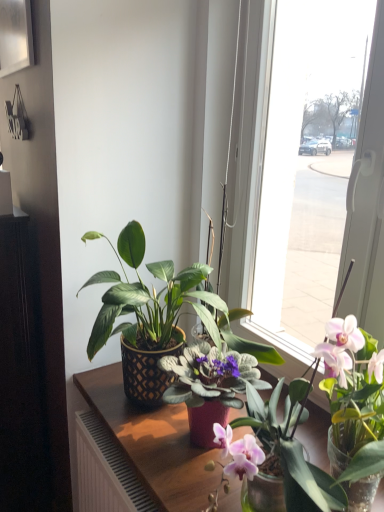
Question: Is wooden table at center taller or shorter than metallic silver picture frame at upper left?

Choices:
 (A) tall
 (B) short

Answer: (A)

Question: Considering the positions of wooden table at center and metallic silver picture frame at upper left in the image, is wooden table at center wider or thinner than metallic silver picture frame at upper left?

Choices:
 (A) wide
 (B) thin

Answer: (A)

Question: Which is nearer to the metallic silver picture frame at upper left?

Choices:
 (A) matte black pot at center
 (B) wooden table at center

Answer: (B)

Question: Estimate the real-world distances between objects in this image. Which object is farther from the wooden table at center?

Choices:
 (A) metallic silver picture frame at upper left
 (B) matte black pot at center

Answer: (A)